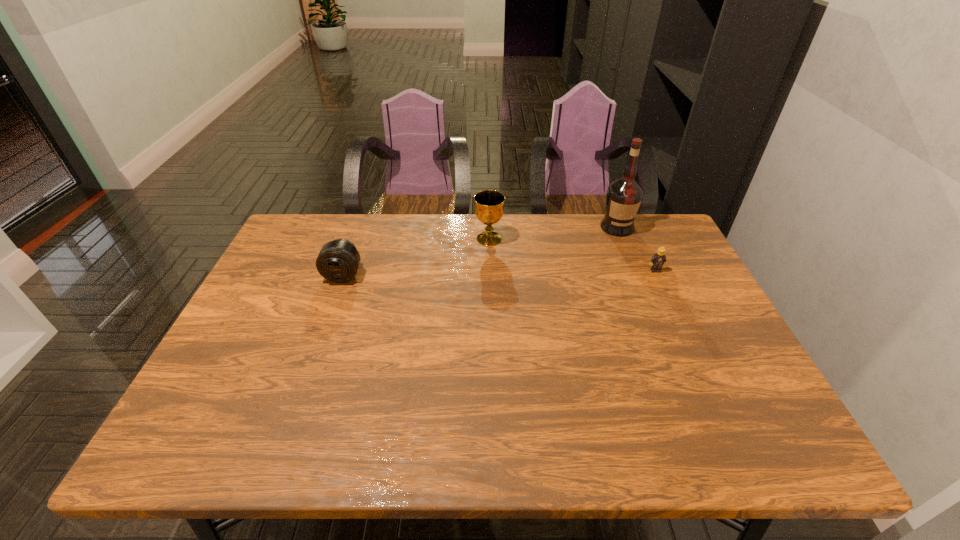
Where is `free space between the tallest object and the leftmost object`? The height and width of the screenshot is (540, 960). free space between the tallest object and the leftmost object is located at coordinates (480, 251).

Choose which object is the second nearest neighbor to the tallest object. Please provide its 2D coordinates. Your answer should be formatted as a tuple, i.e. [(x, y)], where the tuple contains the x and y coordinates of a point satisfying the conditions above.

[(489, 210)]

The width and height of the screenshot is (960, 540). What are the coordinates of `object that is the second closest to the Lego` in the screenshot? It's located at (489, 210).